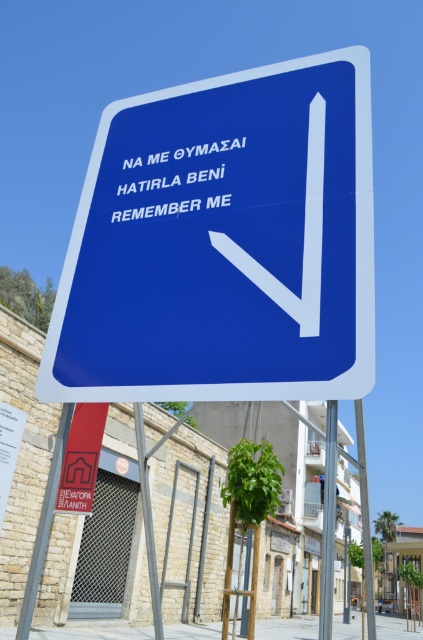
Is blue plastic sign at center wider than matte red house at lower left?

Indeed, blue plastic sign at center has a greater width compared to matte red house at lower left.

Can you confirm if blue plastic sign at center is positioned to the right of matte red house at lower left?

Correct, you'll find blue plastic sign at center to the right of matte red house at lower left.

Is point (120, 273) closer to camera compared to point (71, 472)?

Yes, it is.

You are a GUI agent. You are given a task and a screenshot of the screen. Output one action in this format:
    pyautogui.click(x=<x>, y=<y>)
    Task: Click on the blue plastic sign at center
    
    Given the screenshot: What is the action you would take?
    pyautogui.click(x=224, y=243)

Does matte red house at lower left appear under metallic pole at right?

No, matte red house at lower left is not below metallic pole at right.

Is matte red house at lower left shorter than metallic pole at right?

Indeed, matte red house at lower left has a lesser height compared to metallic pole at right.

The width and height of the screenshot is (423, 640). Find the location of `matte red house at lower left`. matte red house at lower left is located at coordinates (80, 458).

Does white plastic arrow at center have a greater height compared to metallic pole at center?

No.

Between point (308, 147) and point (332, 476), which one is positioned in front?

Point (332, 476) is more forward.

This screenshot has height=640, width=423. Identify the location of white plastic arrow at center. (302, 237).